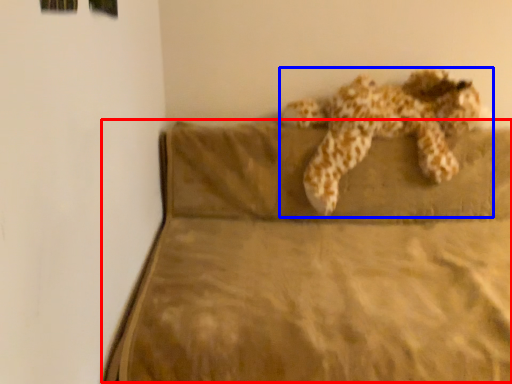
Question: Among these objects, which one is nearest to the camera, mattress (highlighted by a red box) or animal (highlighted by a blue box)?

Choices:
 (A) mattress
 (B) animal

Answer: (A)